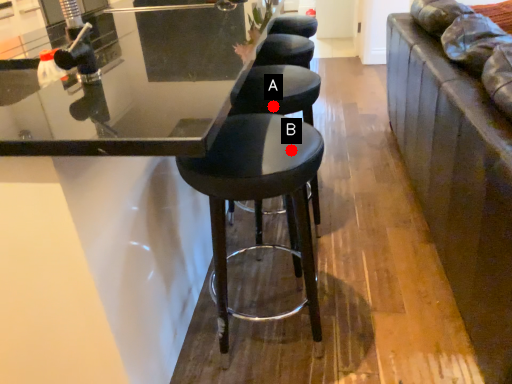
Question: Two points are circled on the image, labeled by A and B beside each circle. Which of the following is the farthest from the observer?

Choices:
 (A) A is further
 (B) B is further

Answer: (A)